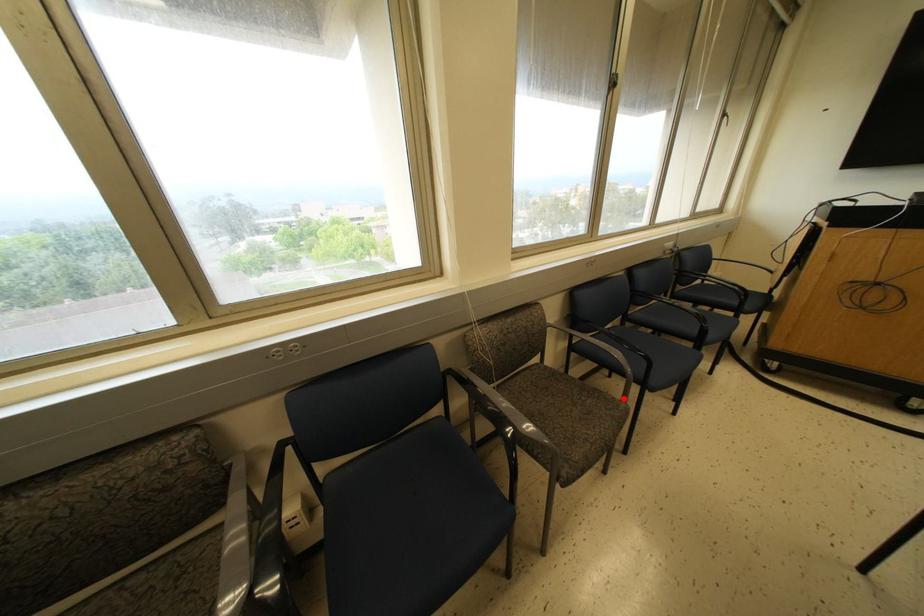
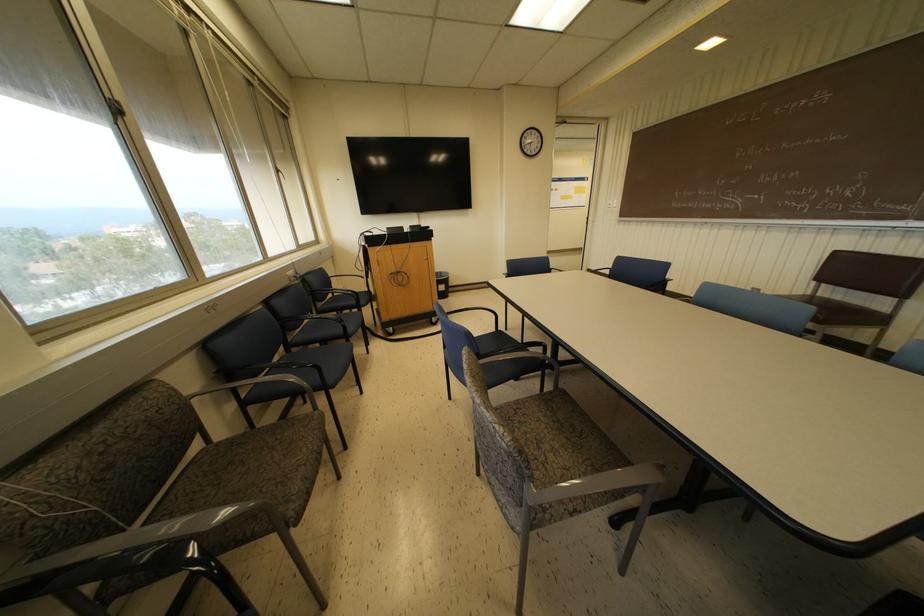
Question: I am providing you with two images of the same scene from different viewpoints. Given a red point in image1, look at the same physical point in image2. Is it:

Choices:
 (A) Closer to the viewpoint
 (B) Farther from the viewpoint

Answer: (A)